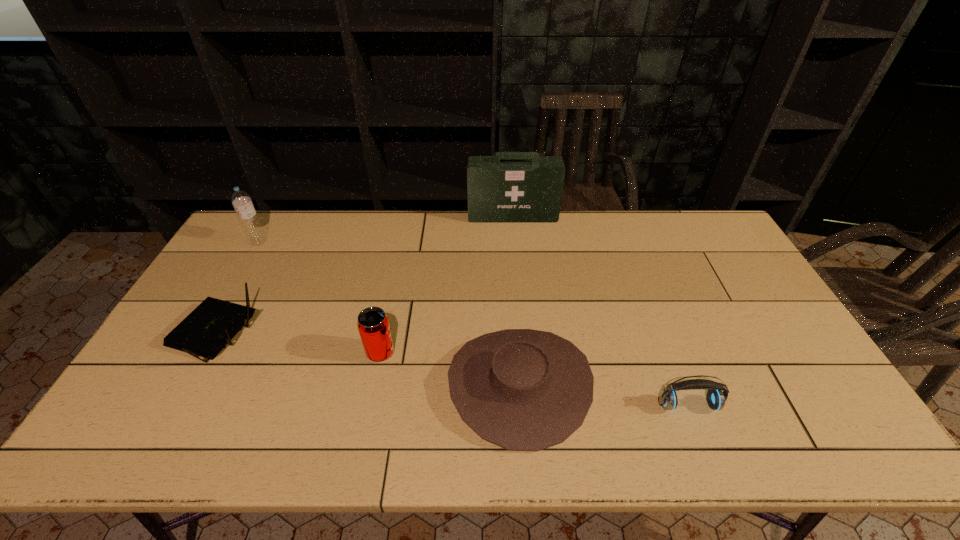
Identify the location of free space located 0.320m on the right of the second tallest object. (358, 241).

Find the location of a particular element. This screenshot has height=540, width=960. free space located 0.160m on the front of the fourth shortest object is located at coordinates (367, 420).

At what (x,y) coordinates should I click in order to perform the action: click on vacant space located on the right of the router. Please return your answer as a coordinate pair (x, y). The image size is (960, 540). Looking at the image, I should click on (294, 336).

I want to click on free space located on the right of the cowboy hat, so click(732, 385).

The width and height of the screenshot is (960, 540). I want to click on the first-aid kit that is positioned at the far edge, so click(510, 187).

Locate an element on the screen. This screenshot has height=540, width=960. water bottle that is positioned at the far edge is located at coordinates coord(241,200).

Where is `object that is at the near edge`? object that is at the near edge is located at coordinates tap(521, 389).

At what (x,y) coordinates should I click in order to perform the action: click on water bottle positioned at the left edge. Please return your answer as a coordinate pair (x, y). Looking at the image, I should click on (241, 200).

I want to click on router that is at the left edge, so click(x=211, y=326).

Identify the location of object at the far left corner. (241, 200).